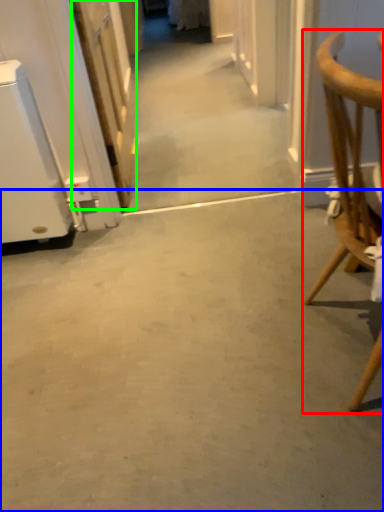
Question: Which object is the farthest from chair (highlighted by a red box)? Choose among these: concrete (highlighted by a blue box) or door (highlighted by a green box).

Choices:
 (A) concrete
 (B) door

Answer: (B)